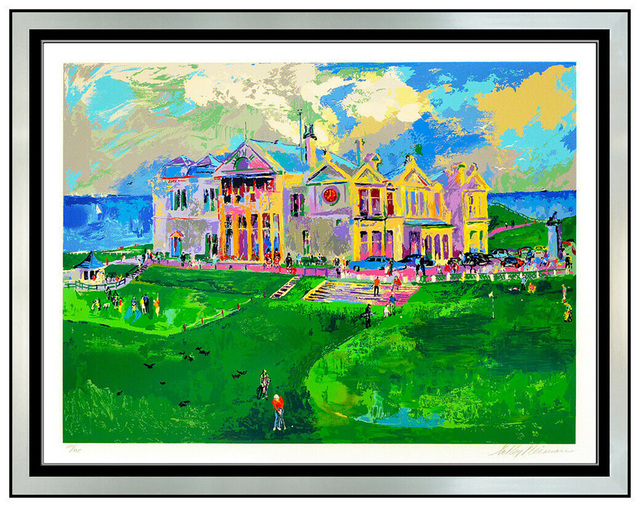
Locate an element on the screen. Image resolution: width=640 pixels, height=507 pixels. painting is located at coordinates (483, 396).